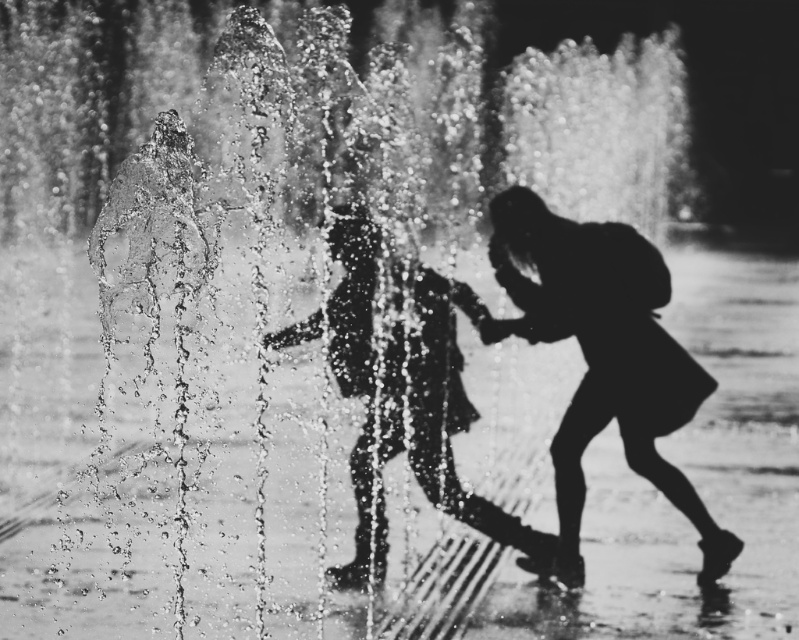
In the black and white photograph of the fountain at night, there are two children depicted as silhouettes wearing silhouette dress at lower right and silhouette dress at center. Which silhouette dress has a taller height?

The silhouette dress at lower right has a greater height compared to the silhouette dress at center.

You are a photographer analyzing the composition of this black and white night scene. You have two points marked in the image at coordinates point (513, 324) and point (511, 529). Based on their positions, which point is closer to the camera?

Point (511, 529) is closer to the camera because it is in front of point (513, 324) according to their spatial arrangement.

You are standing at the center of the fountain and want to find the silhouette dress at lower right. According to the scene description, in which direction should you look to locate it?

The silhouette dress at lower right is located at point (603, 356), which corresponds to the lower right area of the image. Therefore, you should look towards the lower right direction to find it.